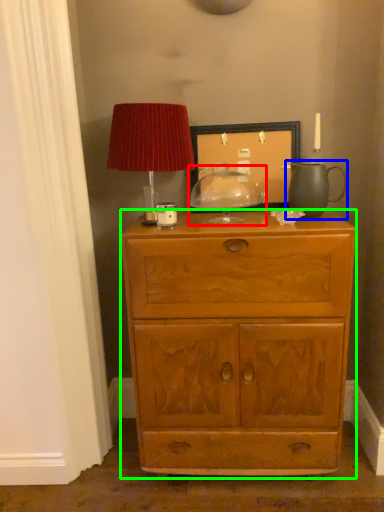
Question: Which object is positioned closest to candle holder (highlighted by a red box)? Select from tea pot (highlighted by a blue box) and chest of drawers (highlighted by a green box).

Choices:
 (A) tea pot
 (B) chest of drawers

Answer: (A)